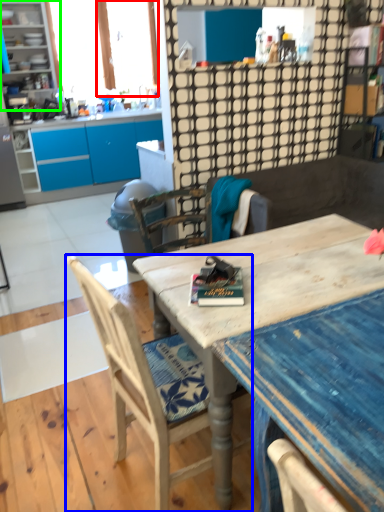
Question: Which object is positioned farthest from window screen (highlighted by a red box)? Select from chair (highlighted by a blue box) and cabinetry (highlighted by a green box).

Choices:
 (A) chair
 (B) cabinetry

Answer: (A)